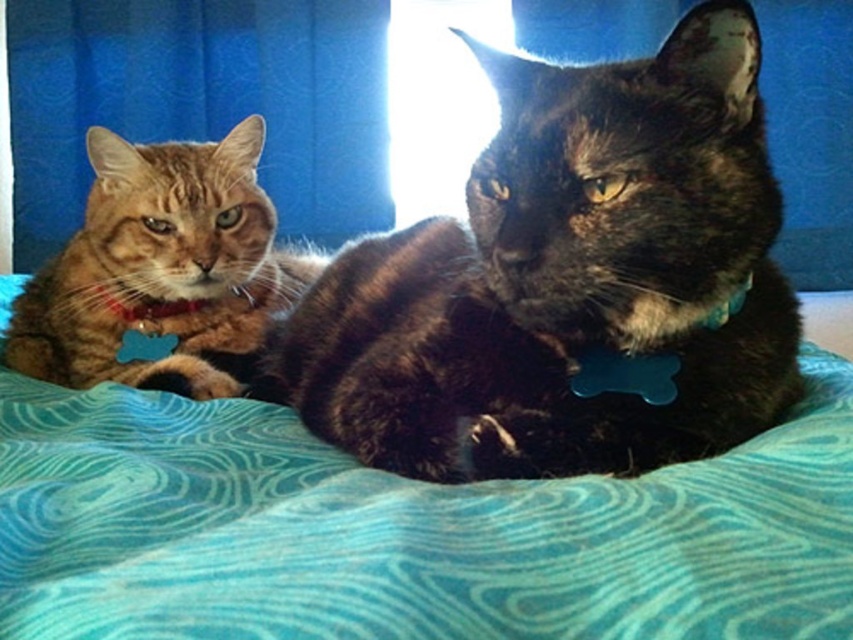
Question: Is teal fabric blanket at center below matte blue curtain at left?

Choices:
 (A) yes
 (B) no

Answer: (A)

Question: Among these objects, which one is farthest from the camera?

Choices:
 (A) teal fabric blanket at center
 (B) orange tabby cat at left
 (C) matte blue curtain at left

Answer: (C)

Question: Is shiny tortoiseshell cat at center above matte blue curtain at left?

Choices:
 (A) yes
 (B) no

Answer: (B)

Question: Among these objects, which one is farthest from the camera?

Choices:
 (A) orange tabby cat at left
 (B) teal fabric blanket at center

Answer: (A)

Question: Which object is closer to the camera taking this photo?

Choices:
 (A) shiny tortoiseshell cat at center
 (B) orange tabby cat at left

Answer: (A)

Question: Is matte blue curtain at left below orange tabby cat at left?

Choices:
 (A) yes
 (B) no

Answer: (B)